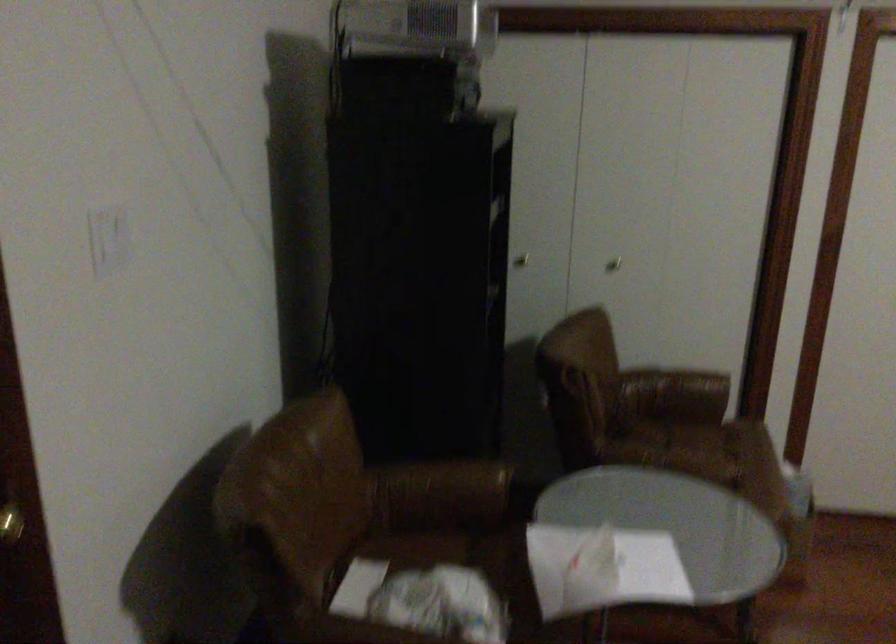
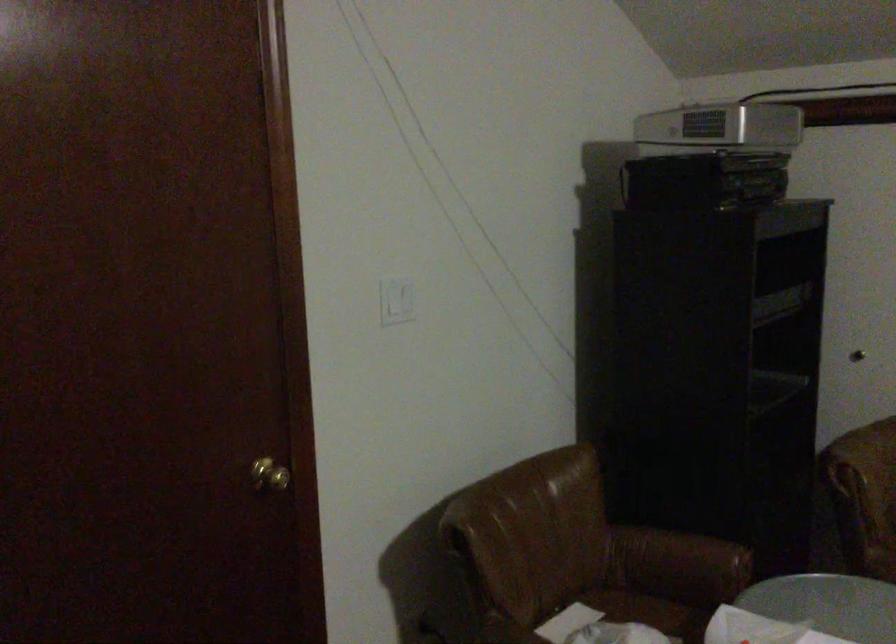
Find the pixel in the second image that matches (113,231) in the first image.

(397, 301)